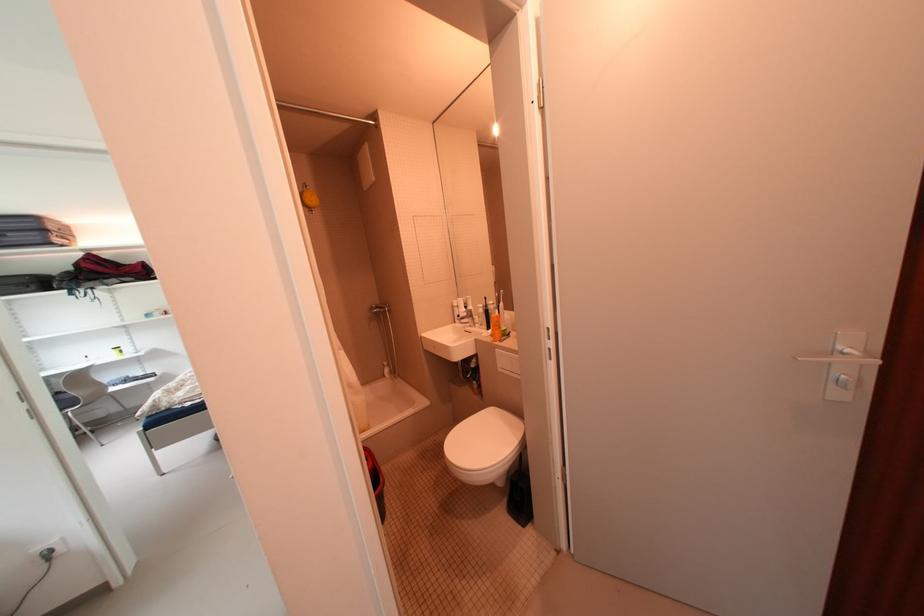
The width and height of the screenshot is (924, 616). I want to click on shower head handle, so click(391, 344).